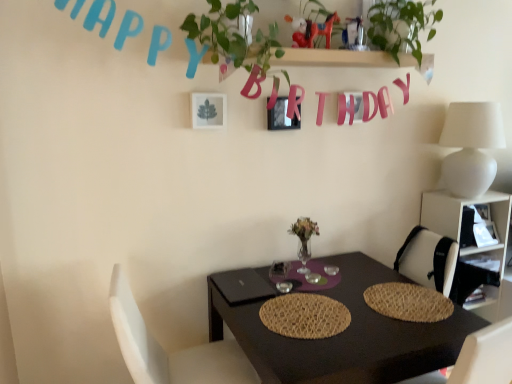
The image size is (512, 384). In order to click on free location to the left of woven straw placemat at center, the second mat positioned from the left in this screenshot , I will do `click(334, 307)`.